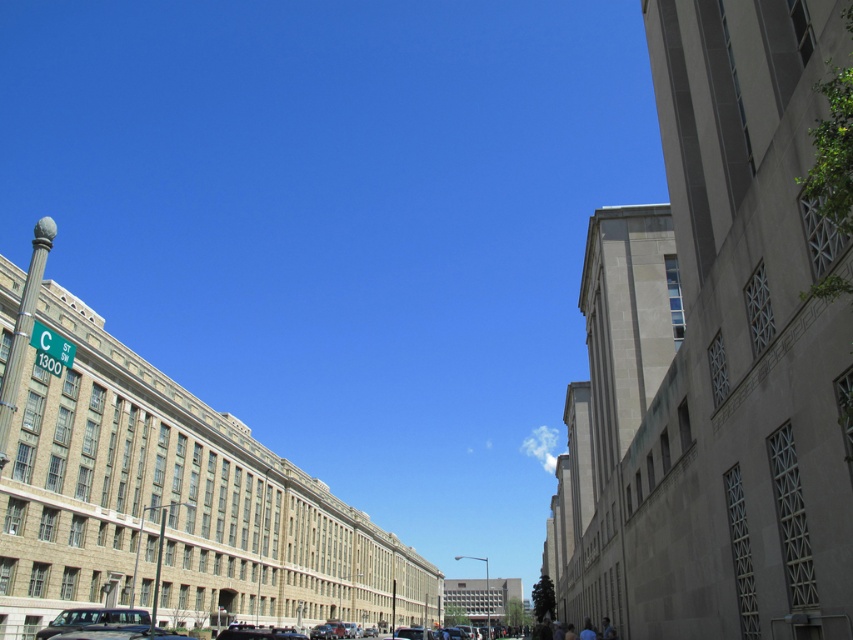
You are a delivery person who needs to park your metallic silver van at lower center in a parking spot that can only accommodate vehicles narrower than the blue fabric shirt at lower right. Can your van fit in the spot?

The metallic silver van at lower center is wider than the blue fabric shirt at lower right, so it cannot fit in the parking spot designed for narrower vehicles.

You are standing at the intersection and see a metallic silver van at lower center. There is a point marked at coordinates [97,621]. Where is this point located?

The point at coordinates [97,621] is located on the metallic silver van at lower center.